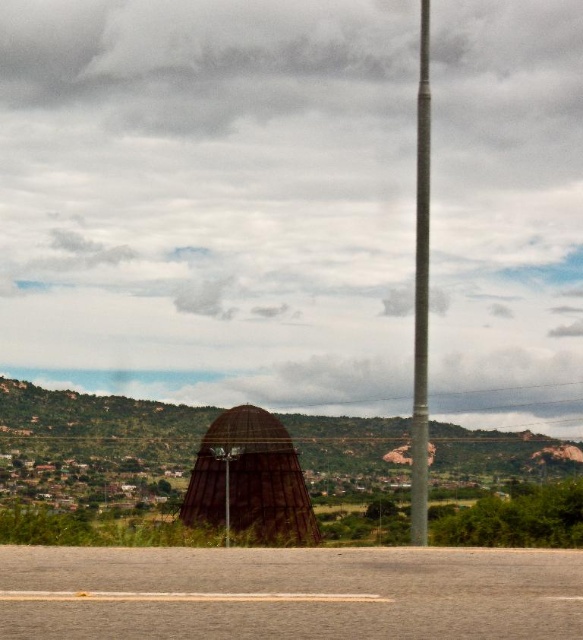
Is point (420, 172) positioned behind point (219, 448)?

No, it is not.

How much distance is there between metallic pole at right and metallic pole at center?

They are 6.78 meters apart.

Describe the element at coordinates (420, 294) in the screenshot. I see `metallic pole at right` at that location.

Locate an element on the screen. The image size is (583, 640). metallic pole at right is located at coordinates (420, 294).

Does brown textured dome at center have a smaller size compared to metallic pole at right?

Yes.

Does brown textured dome at center lie in front of metallic pole at right?

No, brown textured dome at center is further to the viewer.

Does point (381, 428) lie in front of point (416, 442)?

No, it is behind (416, 442).

Image resolution: width=583 pixels, height=640 pixels. Identify the location of brown textured dome at center. (97, 426).

Can you confirm if brown textured dome at center is shorter than metallic pole at center?

In fact, brown textured dome at center may be taller than metallic pole at center.

Which of these two, brown textured dome at center or metallic pole at center, stands taller?

brown textured dome at center is taller.

Is point (405, 442) positioned in front of point (227, 531)?

No, it is not.

This screenshot has height=640, width=583. I want to click on brown textured dome at center, so click(97, 426).